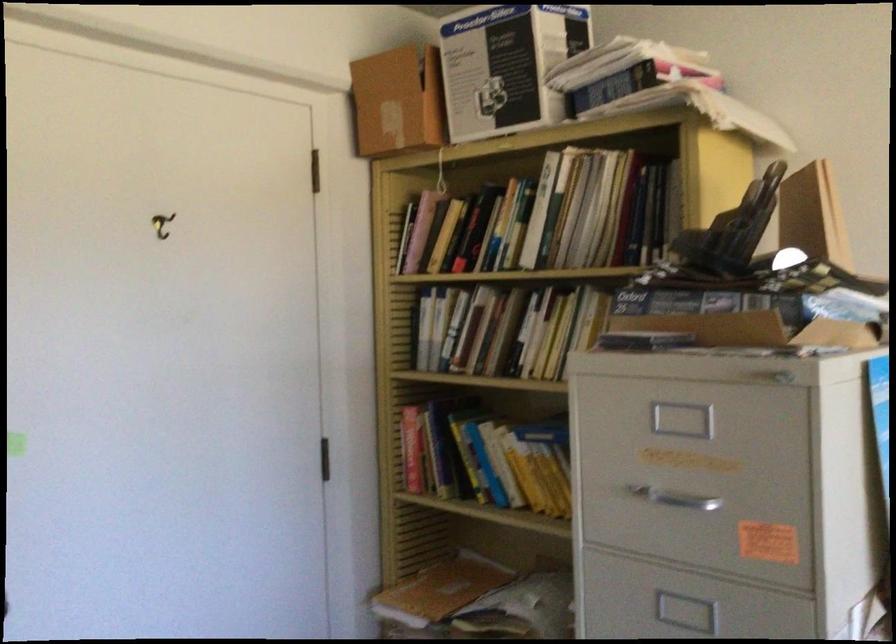
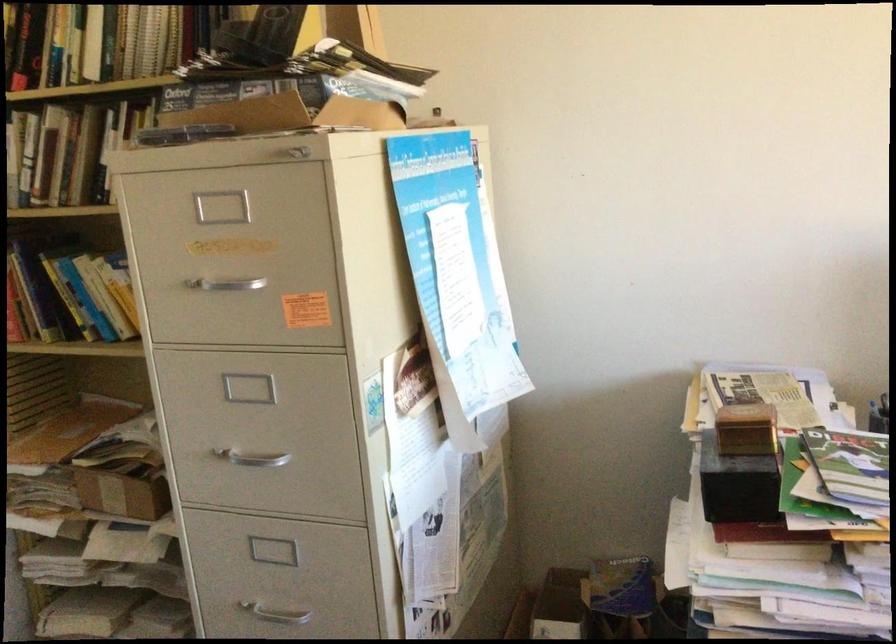
Question: The images are taken continuously from a first-person perspective. In which direction is your viewpoint rotating?

Choices:
 (A) Left
 (B) Right
 (C) Up
 (D) Down

Answer: (B)